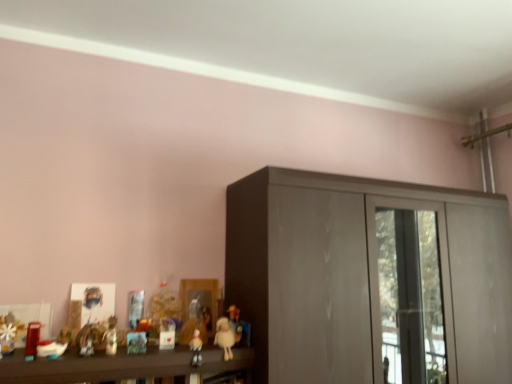
Question: Visually, is matte plastic toy at lower left, the second toy positioned from the left, positioned to the left or to the right of matte yellow plush at center, which appears as the 7th toy when viewed from the left?

Choices:
 (A) left
 (B) right

Answer: (A)

Question: Is point (39, 322) closer or farther from the camera than point (228, 314)?

Choices:
 (A) farther
 (B) closer

Answer: (B)

Question: Based on their relative distances, which object is nearer to the white matte snowflake at left, which is the 7th toy in right-to-left order?

Choices:
 (A) matte plastic toy at lower left, the sixth toy from the right
 (B) matte yellow plush at center, which appears as the 7th toy when viewed from the left
 (C) white matte figurine at center, acting as the fourth toy starting from the right
 (D) matte plastic doll at center, positioned as the fifth toy in left-to-right order
 (E) glossy wood cupboard at center

Answer: (A)

Question: Which object is the farthest from the fluffy white teddy bear at lower center, which is the 6th toy in left-to-right order?

Choices:
 (A) matte plastic toy at lower left, which is the fifth toy from right to left
 (B) matte plastic toy at lower left, the second toy positioned from the left
 (C) matte yellow plush at center, which appears as the 7th toy when viewed from the left
 (D) matte plastic doll at center, which is the 3th toy from right to left
 (E) white matte snowflake at left, which is the 7th toy in right-to-left order

Answer: (E)